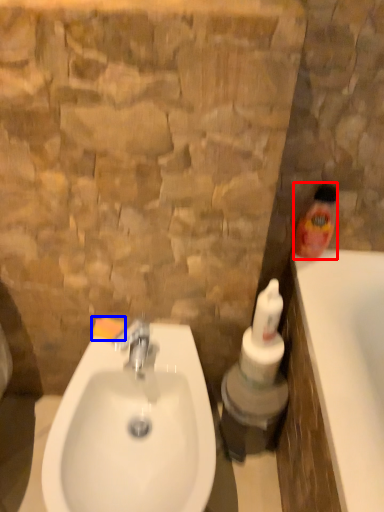
Question: Which object is further to the camera taking this photo, cleaning product (highlighted by a red box) or soap (highlighted by a blue box)?

Choices:
 (A) cleaning product
 (B) soap

Answer: (B)